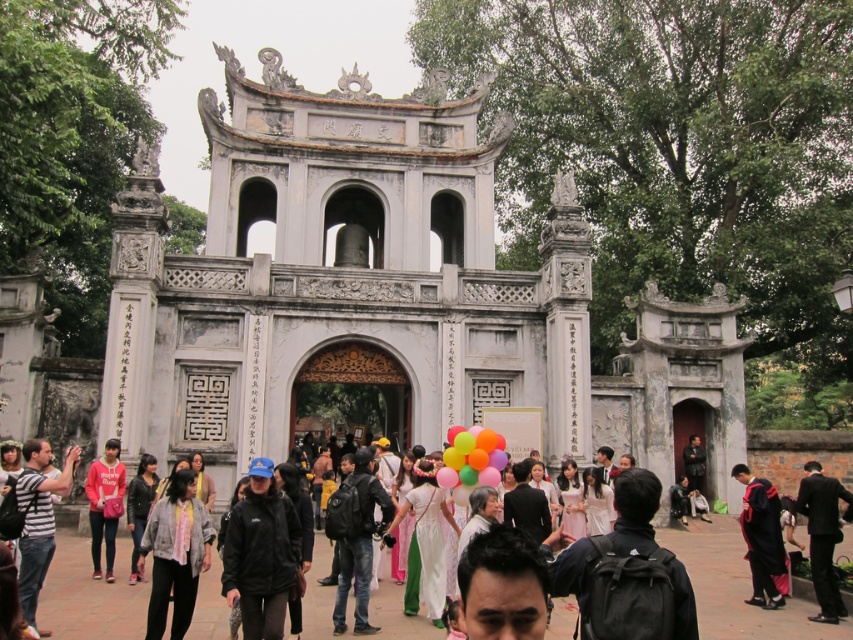
You are attending a graduation ceremony at this historical site and need to walk from the entrance to the stage. There are two people wearing a black matte graduation gown at lower right and a light brown leather jacket at center. Which person is wearing a wider garment?

The black matte graduation gown at lower right is wider than the light brown leather jacket at center, so the person wearing the black matte graduation gown at lower right has a wider garment.

You are standing in front of the ornate gateway and notice a striped cotton shirt at lower left and a pink satin dress at center. Which piece of clothing is nearer to you?

The striped cotton shirt at lower left is closer to the viewer than the pink satin dress at center.

You are standing at the entrance of the temple and see two points marked in the image. The first point is at coordinates point (x=148, y=628) and the second is at point (x=572, y=504). Which of these points is closer to you as you face the gateway?

Point (x=148, y=628) is closer to you because it is in front of point (x=572, y=504).